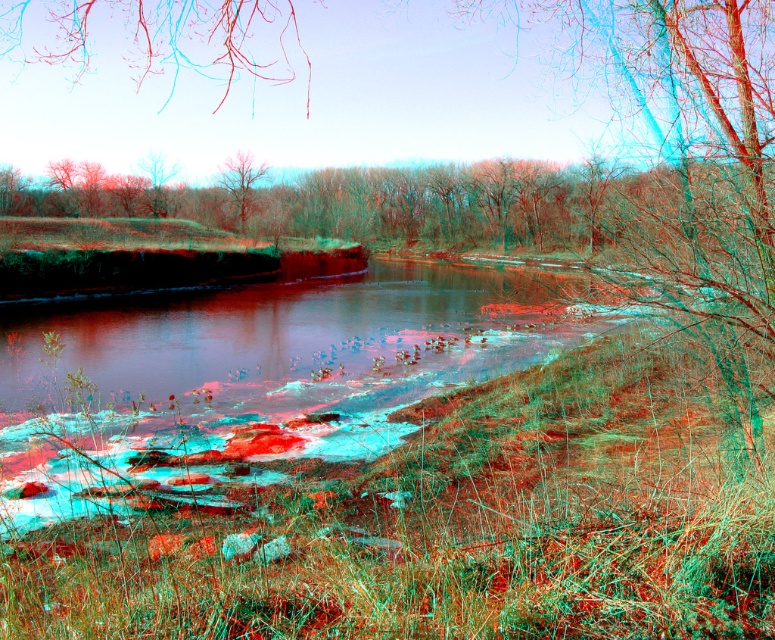
Between green matte tree at center and smooth bark tree at upper left, which one is positioned lower?

green matte tree at center

Does green matte tree at center have a lesser width compared to smooth bark tree at upper left?

No.

Between point (377, 220) and point (140, 160), which one is positioned behind?

The point (377, 220) is more distant.

Where is `green matte tree at center`? Image resolution: width=775 pixels, height=640 pixels. green matte tree at center is located at coordinates (491, 204).

Measure the distance between point (228, 202) and camera.

A distance of 225.39 feet exists between point (228, 202) and camera.

Does green matte tree at center appear on the left side of smooth bark tree at center?

Incorrect, green matte tree at center is not on the left side of smooth bark tree at center.

Does point (422, 204) come farther from viewer compared to point (252, 184)?

Yes, it is.

You are a GUI agent. You are given a task and a screenshot of the screen. Output one action in this format:
    pyautogui.click(x=<x>, y=<y>)
    Task: Click on the green matte tree at center
    The image size is (775, 640).
    Given the screenshot: What is the action you would take?
    pyautogui.click(x=491, y=204)

Consider the image. Can you confirm if smooth bark tree at center is positioned to the right of smooth bark tree at upper left?

Correct, you'll find smooth bark tree at center to the right of smooth bark tree at upper left.

What do you see at coordinates (240, 182) in the screenshot? This screenshot has height=640, width=775. I see `smooth bark tree at center` at bounding box center [240, 182].

The width and height of the screenshot is (775, 640). I want to click on smooth bark tree at center, so click(240, 182).